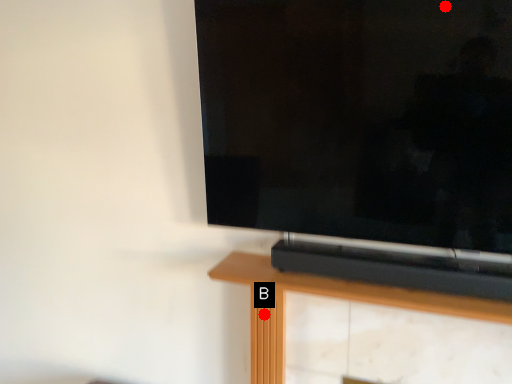
Question: Two points are circled on the image, labeled by A and B beside each circle. Which point is farther to the camera?

Choices:
 (A) A is further
 (B) B is further

Answer: (B)